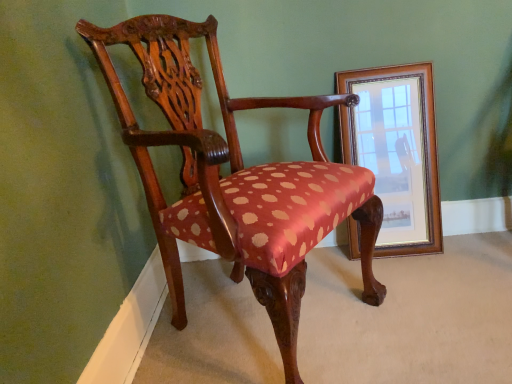
Question: From their relative heights in the image, would you say wooden framed mirror at right is taller or shorter than polished wood chair at center?

Choices:
 (A) tall
 (B) short

Answer: (B)

Question: Considering the positions of wooden framed mirror at right and polished wood chair at center in the image, is wooden framed mirror at right wider or thinner than polished wood chair at center?

Choices:
 (A) wide
 (B) thin

Answer: (B)

Question: From the image's perspective, is wooden framed mirror at right positioned above or below polished wood chair at center?

Choices:
 (A) below
 (B) above

Answer: (B)

Question: Considering the positions of point (174, 56) and point (352, 144), is point (174, 56) closer or farther from the camera than point (352, 144)?

Choices:
 (A) closer
 (B) farther

Answer: (A)

Question: Is polished wood chair at center in front of or behind wooden framed mirror at right in the image?

Choices:
 (A) front
 (B) behind

Answer: (A)

Question: Do you think polished wood chair at center is within wooden framed mirror at right, or outside of it?

Choices:
 (A) outside
 (B) inside

Answer: (A)

Question: From the image's perspective, is polished wood chair at center located above or below wooden framed mirror at right?

Choices:
 (A) above
 (B) below

Answer: (B)